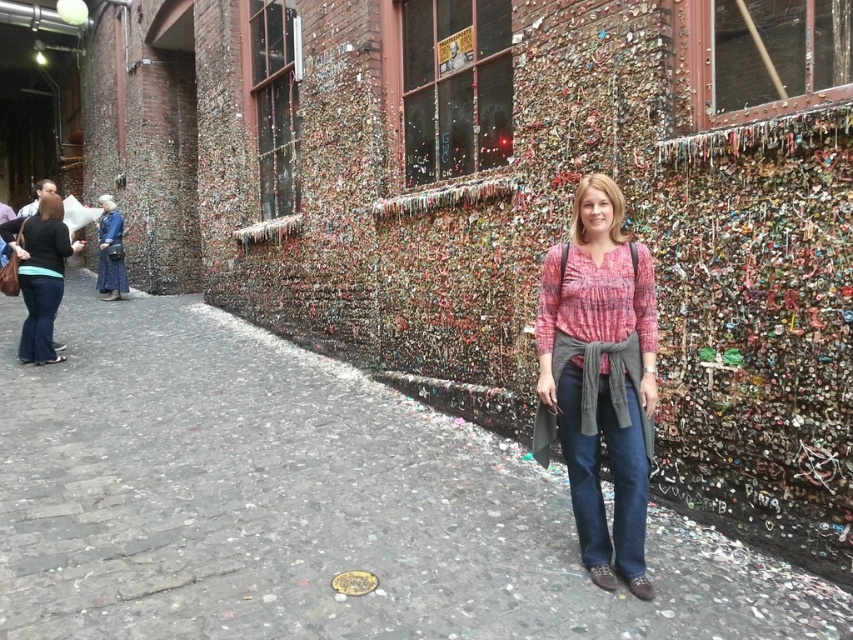
You are standing in the alleyway scene and want to find the matte black shirt at left. According to the coordinates provided, where should you look relative to the image frame?

The matte black shirt at left is located at the coordinates point 0.431 on the x axis and 0.048 on the y axis relative to the image frame.